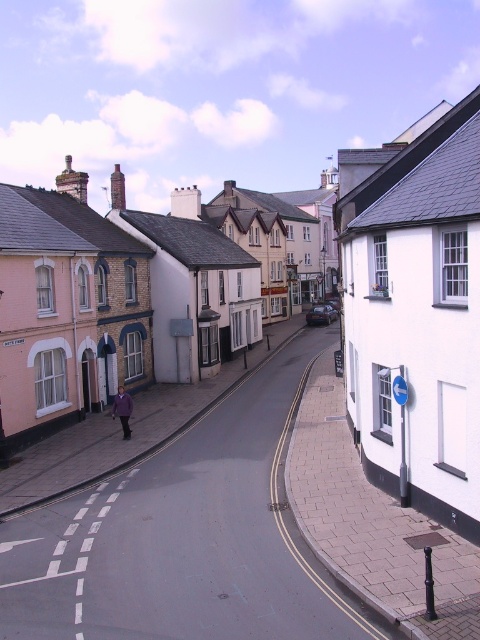
You are a tourist standing on the sidewalk and see the white matte building at center and the purple fabric jacket at center. Which object is higher in the image?

The white matte building at center is higher than the purple fabric jacket at center.

You are standing at the entrance of the street and want to take a photo of the white matte building at center without the purple fabric jacket at center appearing in the frame. Is this possible given their positions?

The white matte building at center is in front of the purple fabric jacket at center, so it is possible to take a photo of the white matte building at center without the purple fabric jacket at center appearing in the frame by focusing on the building which is closer to the camera.

Looking at this image, you are a tourist standing on the sidewalk and want to take a photo of both the white matte building at center and the purple fabric jacket at center. Which object should you focus on first to ensure both are in the frame?

The white matte building at center is wider than the purple fabric jacket at center, so you should focus on the white matte building at center first to ensure both fit in the frame.